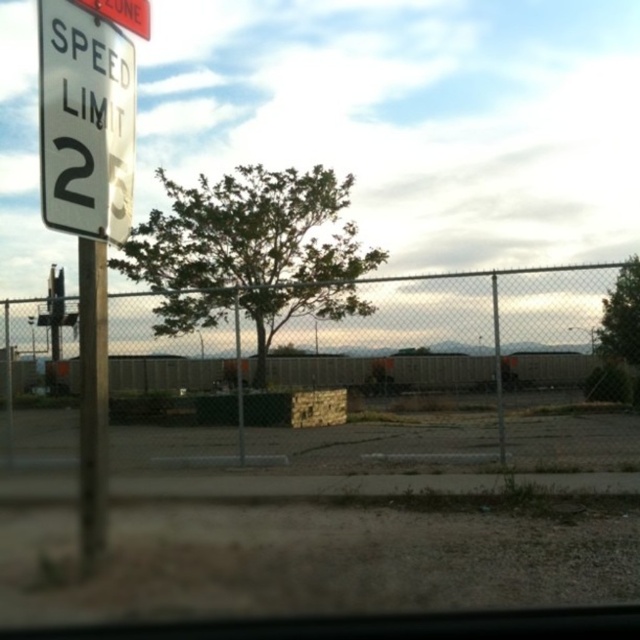
Question: Is metal chain-link fence at center smaller than metallic pole at left?

Choices:
 (A) no
 (B) yes

Answer: (A)

Question: Where is metal chain-link fence at center located in relation to metallic pole at left in the image?

Choices:
 (A) right
 (B) left

Answer: (A)

Question: Does metal chain-link fence at center come in front of metallic pole at left?

Choices:
 (A) no
 (B) yes

Answer: (A)

Question: Which of the following is the closest to the observer?

Choices:
 (A) (362, 433)
 (B) (90, 529)

Answer: (B)

Question: Which of the following is the closest to the observer?

Choices:
 (A) metal chain-link fence at center
 (B) metallic pole at left

Answer: (B)